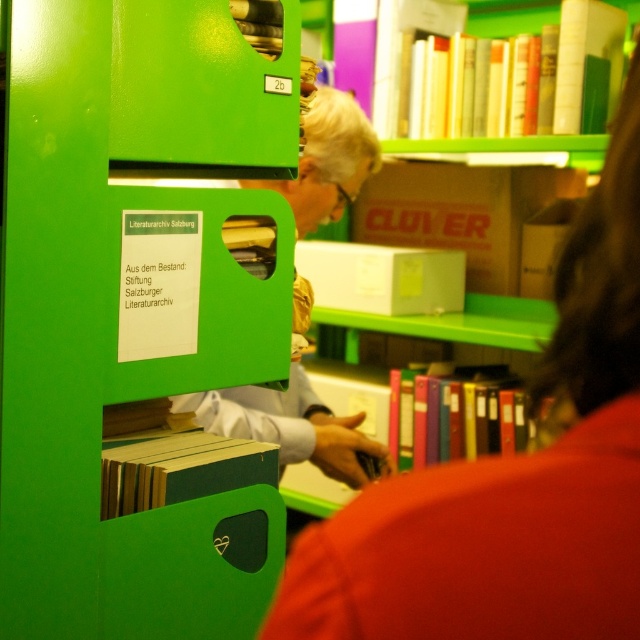
You are a librarian who needs to place a new book on the shelf. The new book is the same height as the green matte book at center. Can you fit it on the green plastic bookcase at left?

The green plastic bookcase at left is taller than the green matte book at center, so yes, the new book can be placed on the green plastic bookcase at left since it has enough height to accommodate it.

You are organizing items in the library section shown. You need to place a new item on the shelf. The shelf has limited space. Which object, the matte black laptop at upper center or the cardboard box at center, is positioned lower and thus might allow placing the new item above it?

The matte black laptop at upper center is located below the cardboard box at center, so placing the new item above the laptop would be possible since it is lower.